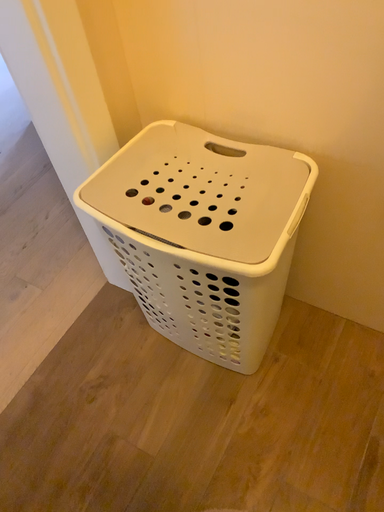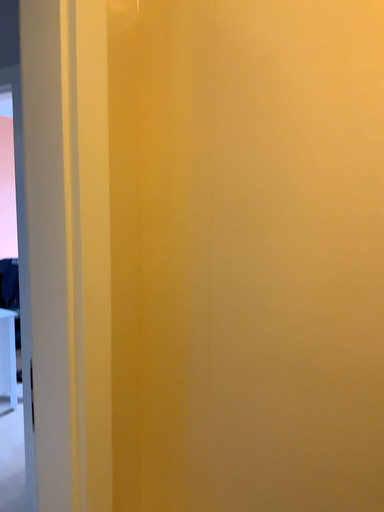
Question: Which way did the camera rotate in the video?

Choices:
 (A) rotated upward
 (B) rotated downward

Answer: (A)